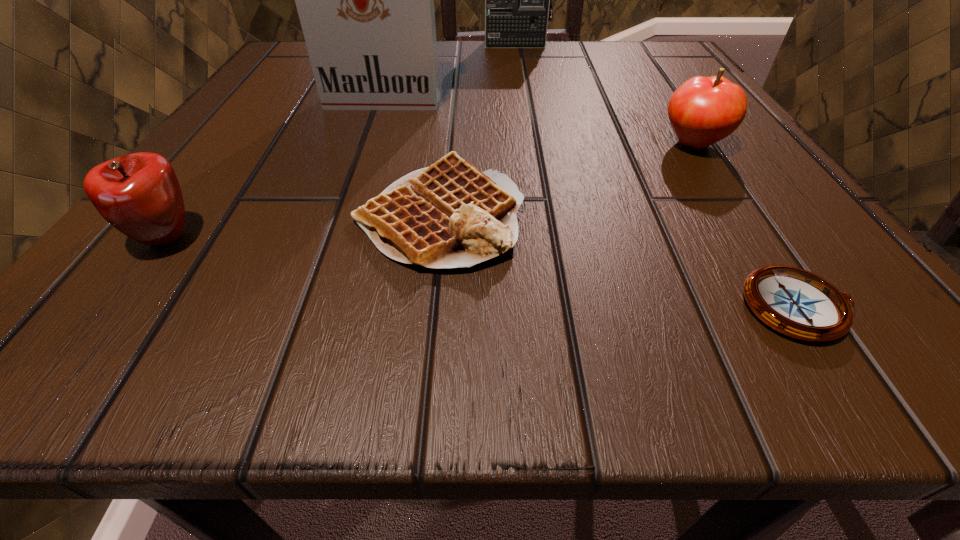
The width and height of the screenshot is (960, 540). In order to click on blank region between the leftmost object and the second shortest object in this screenshot , I will do `click(302, 227)`.

Where is `blank region between the right apple and the radio receiver`? This screenshot has height=540, width=960. blank region between the right apple and the radio receiver is located at coordinates (604, 94).

The width and height of the screenshot is (960, 540). In order to click on free space between the second farthest object and the nearer apple in this screenshot , I will do `click(275, 168)`.

This screenshot has height=540, width=960. I want to click on vacant point located between the right apple and the fifth tallest object, so point(566,180).

Image resolution: width=960 pixels, height=540 pixels. What are the coordinates of `empty space that is in between the nearer apple and the shortest object` in the screenshot? It's located at (483, 273).

Where is `free space between the cigarette case and the left apple`? free space between the cigarette case and the left apple is located at coordinates (275, 168).

Where is `vacant space in between the farther apple and the fifth nearest object`? The image size is (960, 540). vacant space in between the farther apple and the fifth nearest object is located at coordinates (539, 122).

Where is `vacant area that lies between the second farthest object and the second shortest object`? Image resolution: width=960 pixels, height=540 pixels. vacant area that lies between the second farthest object and the second shortest object is located at coordinates [x=412, y=158].

Where is `unoccupied position between the radio receiver and the farther apple`? unoccupied position between the radio receiver and the farther apple is located at coordinates (604, 94).

Choose which object is the fourth nearest neighbor to the fourth nearest object. Please provide its 2D coordinates. Your answer should be formatted as a tuple, i.e. [(x, y)], where the tuple contains the x and y coordinates of a point satisfying the conditions above.

[(518, 0)]